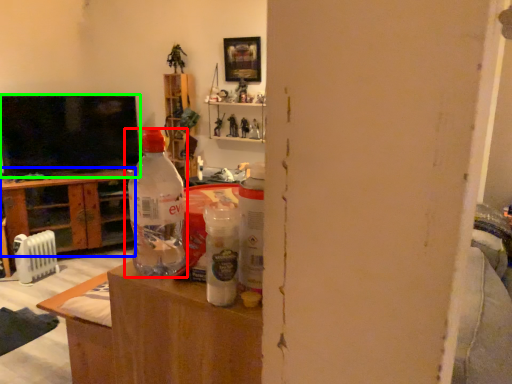
Question: Which object is the farthest from bottle (highlighted by a red box)? Choose among these: cabinetry (highlighted by a blue box) or television (highlighted by a green box).

Choices:
 (A) cabinetry
 (B) television

Answer: (A)